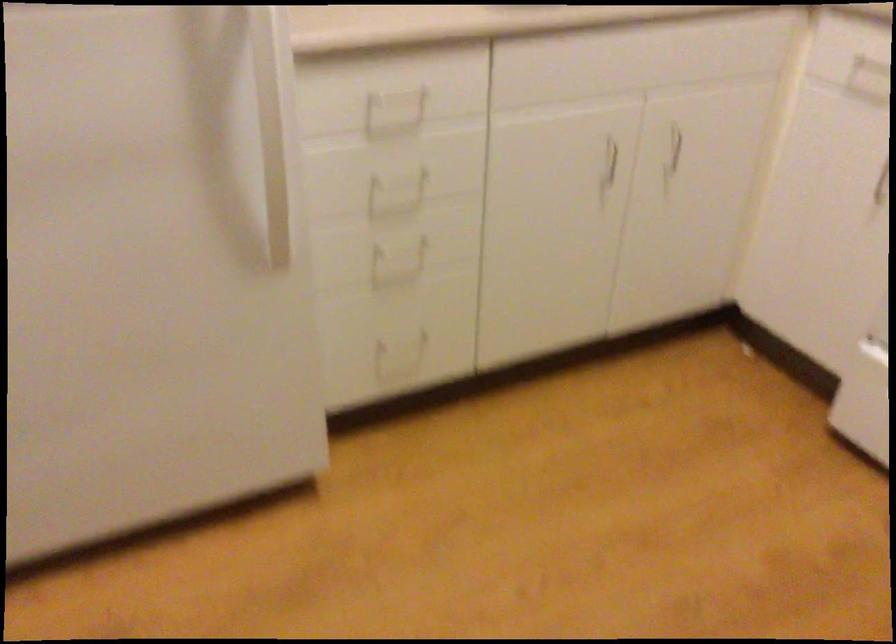
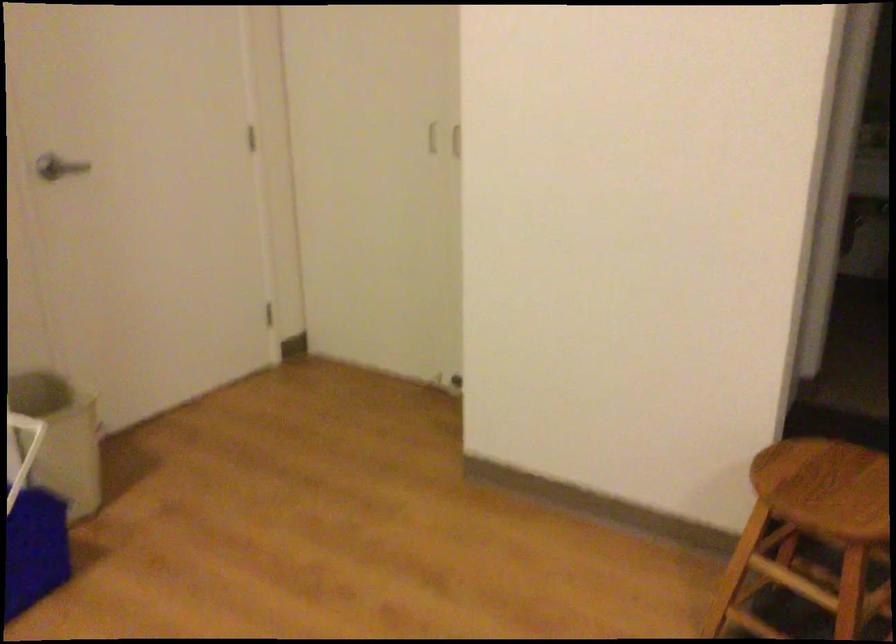
First-person continuous shooting, in which direction is the camera rotating?

The camera's rotation is toward right-down.